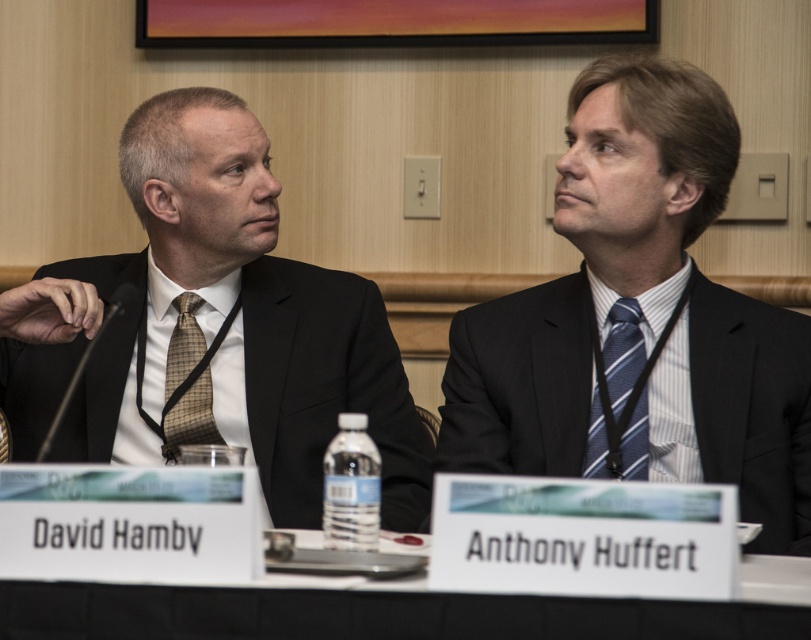
Is point (732, 355) less distant than point (169, 390)?

Yes, it is.

Describe the element at coordinates (591, 273) in the screenshot. This screenshot has width=811, height=640. I see `matte black suit at center` at that location.

I want to click on matte black suit at center, so click(x=591, y=273).

Between matte black suit at left and blue striped tie at center, which one is positioned higher?

matte black suit at left

Is matte black suit at left below blue striped tie at center?

No, matte black suit at left is not below blue striped tie at center.

Identify the location of matte black suit at left. pyautogui.click(x=212, y=328).

Is point (629, 300) in front of point (176, 346)?

Yes, point (629, 300) is closer to viewer.

Locate an element on the screen. blue striped tie at center is located at coordinates (618, 397).